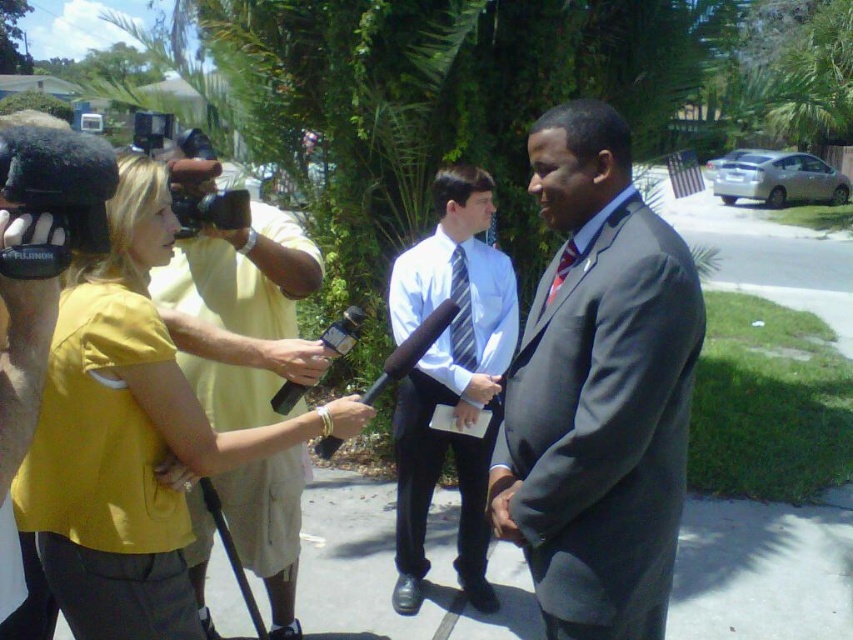
Question: Which of the following is the farthest from the observer?

Choices:
 (A) (598, 460)
 (B) (465, 573)
 (C) (451, 358)

Answer: (B)

Question: Which point is closer to the camera?

Choices:
 (A) striped fabric tie at center
 (B) yellow fabric shirt at left

Answer: (B)

Question: From the image, what is the correct spatial relationship of matte yellow shirt at center in relation to blue striped tie at center?

Choices:
 (A) below
 (B) above

Answer: (A)

Question: Does light blue shirt and tie at center have a larger size compared to blue striped tie at center?

Choices:
 (A) no
 (B) yes

Answer: (B)

Question: Considering the relative positions of yellow fabric shirt at left and striped fabric tie at center in the image provided, where is yellow fabric shirt at left located with respect to striped fabric tie at center?

Choices:
 (A) right
 (B) left

Answer: (B)

Question: Which point is closer to the camera?

Choices:
 (A) dark gray suit at center
 (B) blue striped tie at center
 (C) striped fabric tie at center
 (D) light blue shirt and tie at center

Answer: (A)